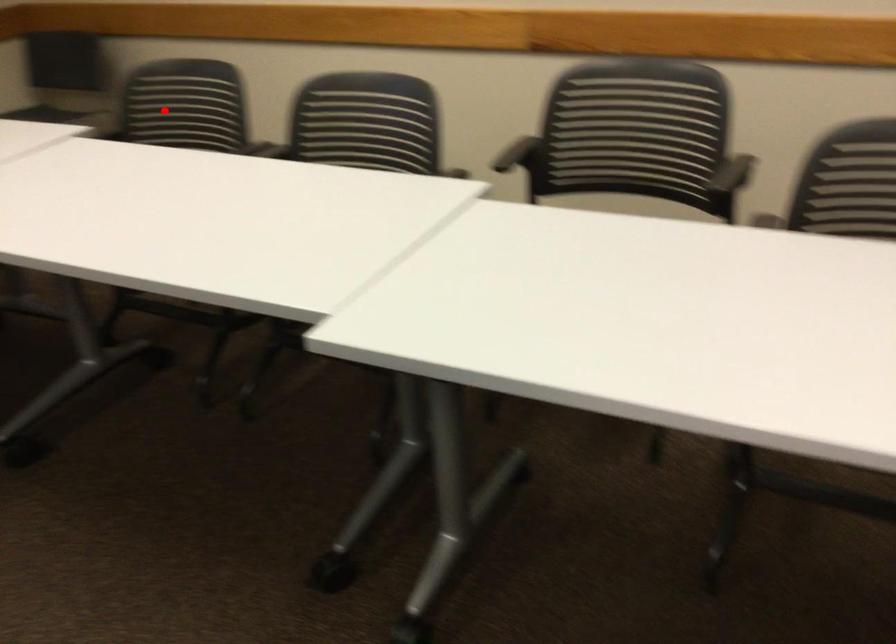
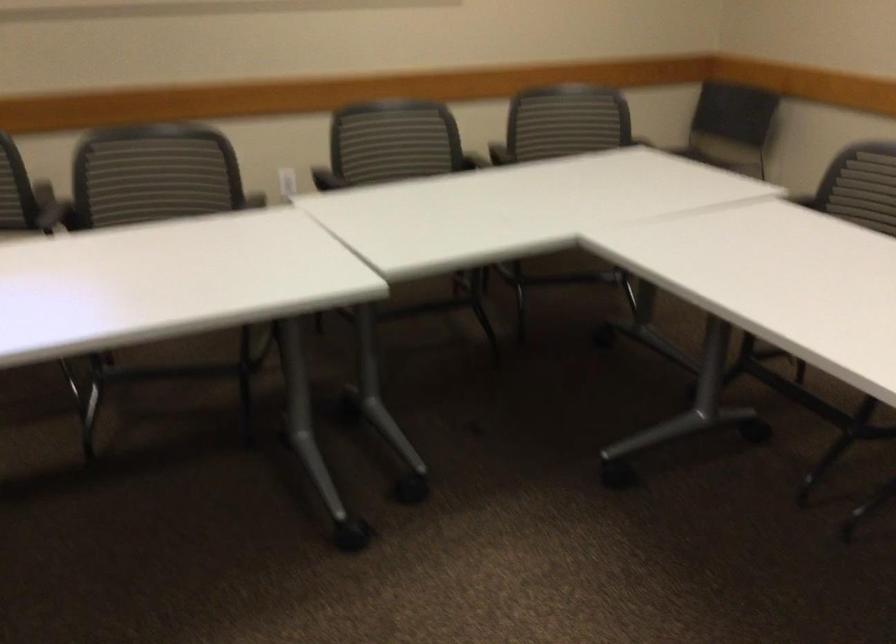
Question: A red point is marked in image1. In image2, is the corresponding 3D point closer to the camera or farther? Reply with the corresponding letter.

Choices:
 (A) The corresponding 3D point is closer.
 (B) The corresponding 3D point is farther.

Answer: (A)